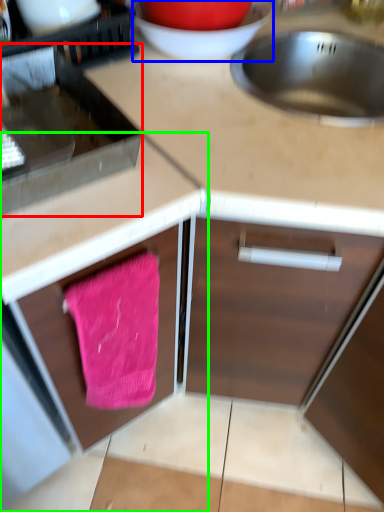
Question: Based on their relative distances, which object is nearer to appliance (highlighted by a red box)? Choose from basin (highlighted by a blue box) and cabinetry (highlighted by a green box).

Choices:
 (A) basin
 (B) cabinetry

Answer: (B)